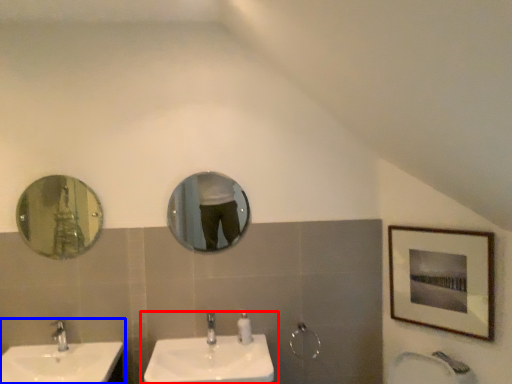
Question: Which point is further to the camera, sink (highlighted by a red box) or sink (highlighted by a blue box)?

Choices:
 (A) sink
 (B) sink

Answer: (A)